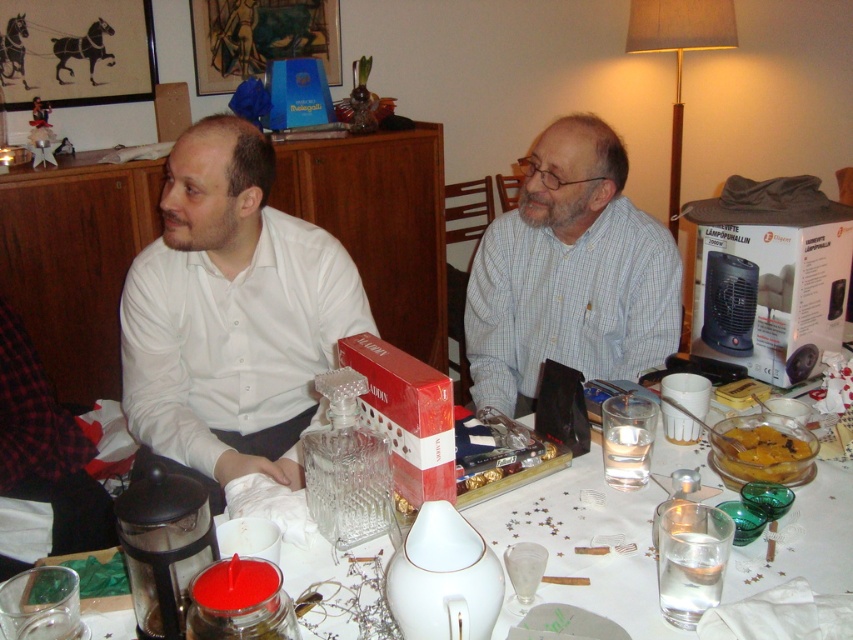
You are standing in the room and want to hand a gift to the person wearing the white matte shirt at left. Based on their position, where should you approach from to reach them directly?

The white matte shirt at left is located at point (230, 316), so you should approach from the left side to reach them directly.

You are standing at the entrance of the room and want to determine which object is closer to you between the white matte shirt at left and the white ceramic vase at center. Based on their heights in the image, can you infer which one is nearer?

The white matte shirt at left is taller than the white ceramic vase at center in the image. Since objects closer to the viewer appear larger, the white matte shirt at left is likely nearer to you.